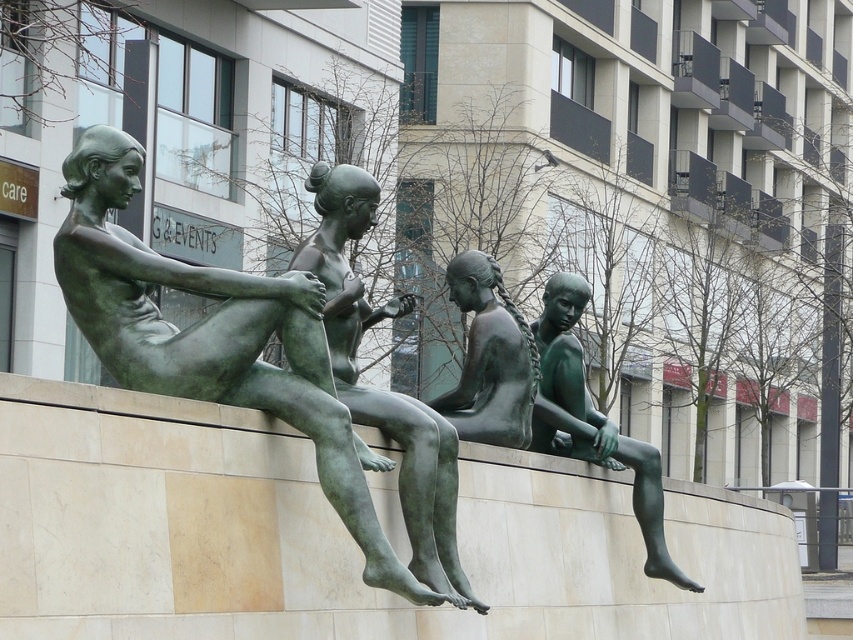
Does green polished bronze girl at lower right have a larger size compared to green patina statue at center?

Yes, green polished bronze girl at lower right is bigger than green patina statue at center.

Which is in front, point (556, 422) or point (450, 419)?

Point (450, 419) is more forward.

Does point (572, 289) lie behind point (482, 260)?

That is True.

Where is `green polished bronze girl at lower right`? green polished bronze girl at lower right is located at coordinates (x=592, y=419).

Can you confirm if green bronze statue at center is smaller than green patina statue at center?

Actually, green bronze statue at center might be larger than green patina statue at center.

Who is more distant from viewer, (456, 481) or (450, 413)?

Point (450, 413)

Where is `green bronze statue at center`? Image resolution: width=853 pixels, height=640 pixels. green bronze statue at center is located at coordinates (386, 390).

Between green patina bronze sculpture at left and green bronze statue at center, which one has less height?

green bronze statue at center is shorter.

Which is in front, point (103, 262) or point (366, 312)?

Positioned in front is point (103, 262).

The height and width of the screenshot is (640, 853). In order to click on green patina bronze sculpture at left in this screenshot , I will do pos(213,339).